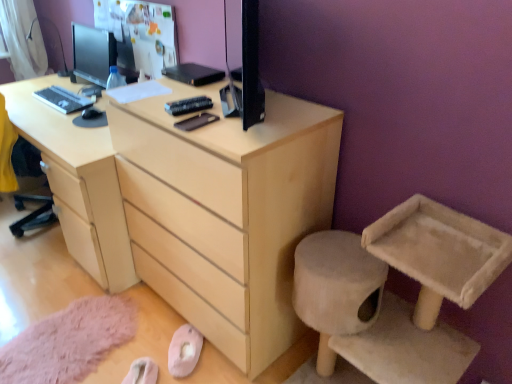
Question: Is light wood chest of drawers at center not within beige fabric cat tree at lower right?

Choices:
 (A) yes
 (B) no

Answer: (A)

Question: Is light wood chest of drawers at center positioned in front of beige fabric cat tree at lower right?

Choices:
 (A) yes
 (B) no

Answer: (B)

Question: Is the surface of light wood chest of drawers at center in direct contact with beige fabric cat tree at lower right?

Choices:
 (A) yes
 (B) no

Answer: (B)

Question: Is light wood chest of drawers at center oriented away from beige fabric cat tree at lower right?

Choices:
 (A) no
 (B) yes

Answer: (A)

Question: Considering the relative positions of light wood chest of drawers at center and beige fabric cat tree at lower right in the image provided, is light wood chest of drawers at center to the left of beige fabric cat tree at lower right from the viewer's perspective?

Choices:
 (A) no
 (B) yes

Answer: (B)

Question: Considering their positions, is beige fabric cat tree at lower right located in front of or behind matte black keyboard at left?

Choices:
 (A) front
 (B) behind

Answer: (A)

Question: In terms of width, does beige fabric cat tree at lower right look wider or thinner when compared to matte black keyboard at left?

Choices:
 (A) thin
 (B) wide

Answer: (B)

Question: From the image's perspective, is beige fabric cat tree at lower right above or below matte black keyboard at left?

Choices:
 (A) below
 (B) above

Answer: (A)

Question: Considering the relative positions of beige fabric cat tree at lower right and matte black keyboard at left in the image provided, is beige fabric cat tree at lower right to the left or to the right of matte black keyboard at left?

Choices:
 (A) left
 (B) right

Answer: (B)

Question: Is light wood desk at center taller or shorter than beige fabric cat tree at lower right?

Choices:
 (A) short
 (B) tall

Answer: (A)

Question: Considering the positions of light wood desk at center and beige fabric cat tree at lower right in the image, is light wood desk at center bigger or smaller than beige fabric cat tree at lower right?

Choices:
 (A) big
 (B) small

Answer: (A)

Question: Is point (19, 97) closer or farther from the camera than point (322, 309)?

Choices:
 (A) closer
 (B) farther

Answer: (B)

Question: Is light wood desk at center inside or outside of beige fabric cat tree at lower right?

Choices:
 (A) outside
 (B) inside

Answer: (A)

Question: Looking at their shapes, would you say light wood chest of drawers at center is wider or thinner than light wood desk at center?

Choices:
 (A) thin
 (B) wide

Answer: (A)

Question: Would you say light wood chest of drawers at center is to the left or to the right of light wood desk at center in the picture?

Choices:
 (A) right
 (B) left

Answer: (A)